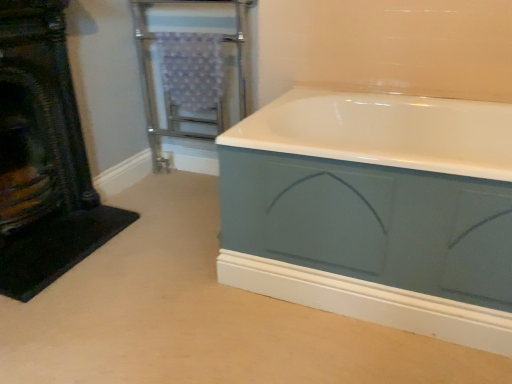
Question: From a real-world perspective, is metallic silver towel rack at upper left located beneath black textured fireplace at left?

Choices:
 (A) no
 (B) yes

Answer: (B)

Question: Can you confirm if metallic silver towel rack at upper left is wider than black textured fireplace at left?

Choices:
 (A) yes
 (B) no

Answer: (A)

Question: From a real-world perspective, is metallic silver towel rack at upper left on black textured fireplace at left?

Choices:
 (A) yes
 (B) no

Answer: (B)

Question: Is metallic silver towel rack at upper left further to the viewer compared to black textured fireplace at left?

Choices:
 (A) no
 (B) yes

Answer: (B)

Question: Can you confirm if metallic silver towel rack at upper left is smaller than black textured fireplace at left?

Choices:
 (A) yes
 (B) no

Answer: (B)

Question: Considering the relative sizes of metallic silver towel rack at upper left and black textured fireplace at left in the image provided, is metallic silver towel rack at upper left thinner than black textured fireplace at left?

Choices:
 (A) yes
 (B) no

Answer: (B)

Question: Is matte blue bathtub at center not within metallic silver towel rack at upper left?

Choices:
 (A) yes
 (B) no

Answer: (A)

Question: Can you confirm if matte blue bathtub at center is wider than metallic silver towel rack at upper left?

Choices:
 (A) no
 (B) yes

Answer: (B)

Question: Is the surface of matte blue bathtub at center in direct contact with metallic silver towel rack at upper left?

Choices:
 (A) no
 (B) yes

Answer: (A)

Question: From a real-world perspective, does matte blue bathtub at center stand above metallic silver towel rack at upper left?

Choices:
 (A) yes
 (B) no

Answer: (B)

Question: Is matte blue bathtub at center at the right side of metallic silver towel rack at upper left?

Choices:
 (A) no
 (B) yes

Answer: (B)

Question: Does matte blue bathtub at center contain metallic silver towel rack at upper left?

Choices:
 (A) no
 (B) yes

Answer: (A)

Question: From the image's perspective, would you say metallic silver towel rack at upper left is shown under matte blue bathtub at center?

Choices:
 (A) no
 (B) yes

Answer: (A)